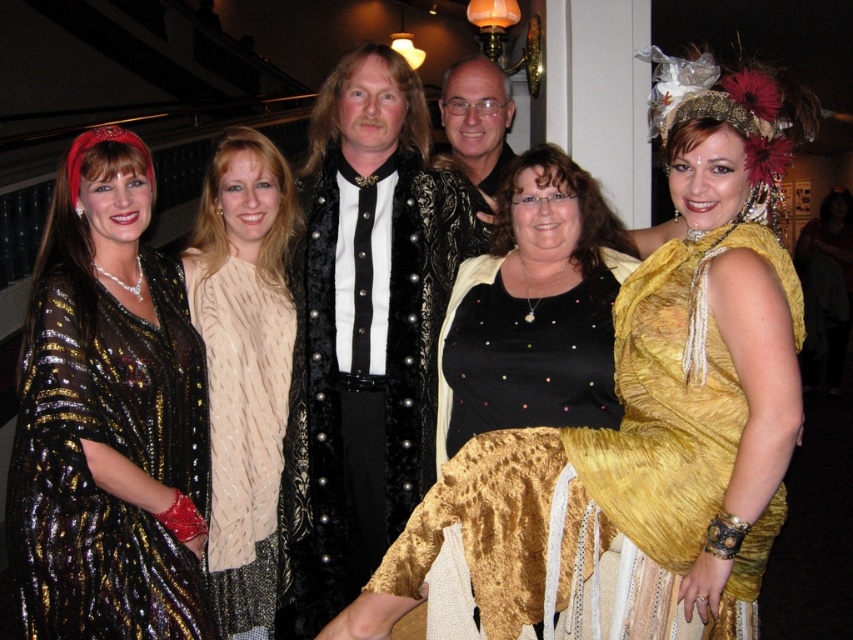
You are a photographer at the event and want to ensure all guests are visible in the group photo. Given that the gold sequined dress at center is taller than the black sequined dress at center, which dress should you ask to stand closer to the front to avoid blocking the view?

The black sequined dress at center should stand closer to the front since it is shorter than the gold sequined dress at center, which is taller and might block the view behind.

You are a photographer adjusting the focus on your camera. You want to ensure both the gold sequined dress at center and the black sequined dress at center are in focus. Given that the camera can only focus on one object at a time, which dress should you focus on first to capture the one that is closer?

You should focus on the gold sequined dress at center first because it is closer to the viewer than the black sequined dress at center.

You are a photographer at the event and need to adjust the lighting to ensure both the gold sequined dress at center and the shiny sequined dress at left are well illuminated. Considering their sizes, which dress might require more focused lighting to capture its details adequately?

The gold sequined dress at center is larger in size than the shiny sequined dress at left, so it might require more focused lighting to capture its details adequately.